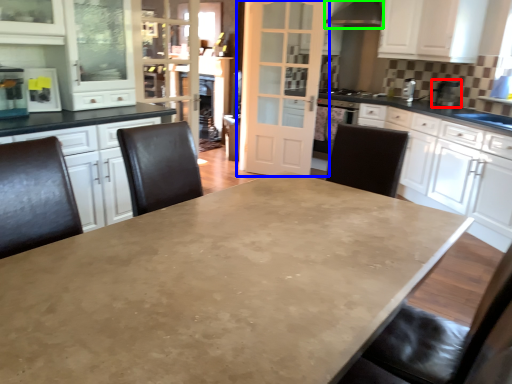
Question: Which object is positioned farthest from appliance (highlighted by a red box)? Select from door (highlighted by a blue box) and exhaust hood (highlighted by a green box).

Choices:
 (A) door
 (B) exhaust hood

Answer: (A)